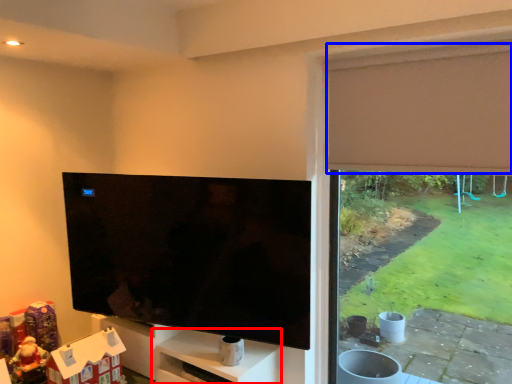
Question: Which object is further to the camera taking this photo, shelf (highlighted by a red box) or curtain (highlighted by a blue box)?

Choices:
 (A) shelf
 (B) curtain

Answer: (A)